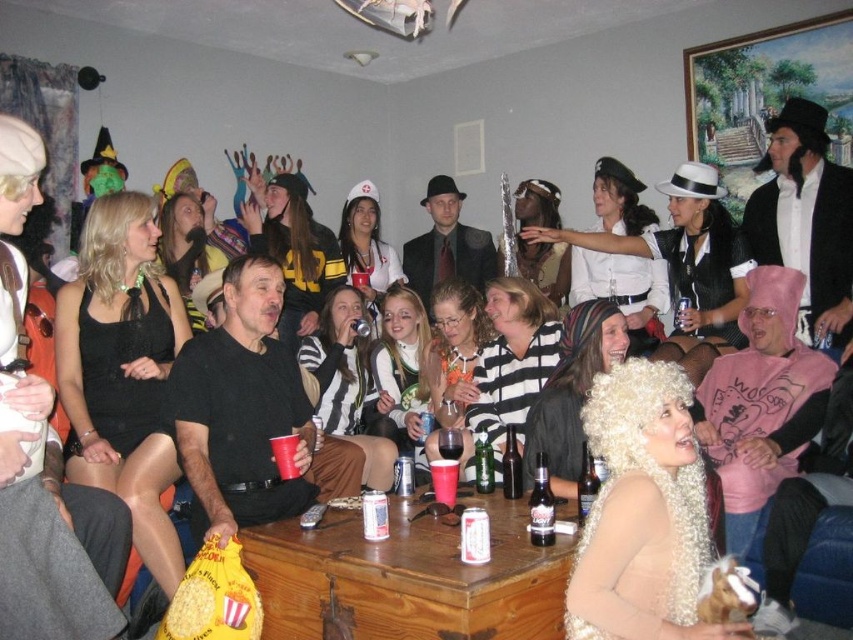
You are at a costume party and need to grab a drink. You see two bottles on the coffee table at center. Which one is higher up between the brown glass beer bottle at center and the dark brown glass bottle at center?

The brown glass beer bottle at center is located above the dark brown glass bottle at center, so it is higher up.

You are at a costume party and need to grab a drink. You see the brown glass beer bottle at center and the dark brown glass bottle at center on the coffee table. Which one is positioned more to the left?

The brown glass beer bottle at center is positioned more to the left than the dark brown glass bottle at center.

Consider the image. You are a guest at the costume party and want to grab a drink from the coffee table. The table has a brown glass beer bottle at center and a dark brown glass bottle at center. How far apart are these two bottles?

The brown glass beer bottle at center and dark brown glass bottle at center are 13.93 centimeters apart.